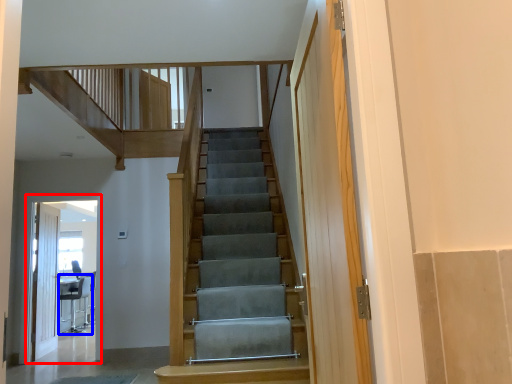
Question: Which of the following is the closest to the observer, elevator (highlighted by a red box) or chair (highlighted by a blue box)?

Choices:
 (A) elevator
 (B) chair

Answer: (A)